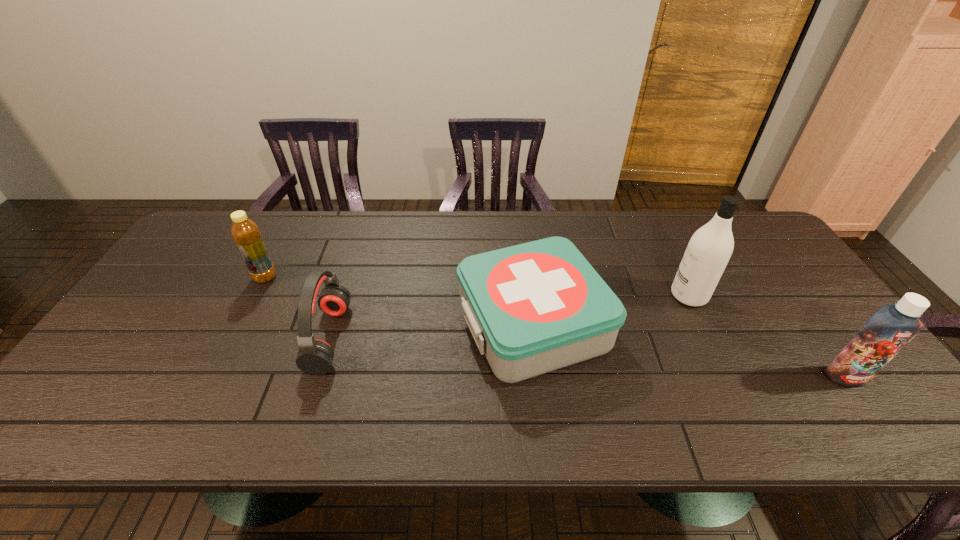
You are a GUI agent. You are given a task and a screenshot of the screen. Output one action in this format:
    pyautogui.click(x=<x>, y=<y>)
    Task: Click on the tallest object
    
    Given the screenshot: What is the action you would take?
    pyautogui.click(x=710, y=247)

Where is `the left shampoo`? This screenshot has width=960, height=540. the left shampoo is located at coordinates (710, 247).

The image size is (960, 540). Find the location of `the nearer shampoo`. the nearer shampoo is located at coordinates (891, 327).

The height and width of the screenshot is (540, 960). What are the coordinates of `the rightmost object` in the screenshot? It's located at 891,327.

The width and height of the screenshot is (960, 540). Find the location of `the leftmost object`. the leftmost object is located at coordinates (246, 234).

Identify the location of the fourth object from right to left. (315, 356).

This screenshot has height=540, width=960. In order to click on earphone in this screenshot , I will do `click(315, 356)`.

Locate an element on the screen. The height and width of the screenshot is (540, 960). the third object from right to left is located at coordinates (532, 308).

I want to click on the first-aid kit, so click(x=532, y=308).

Where is `vacant area situated on the front-facing side of the tallest object`? vacant area situated on the front-facing side of the tallest object is located at coordinates (610, 295).